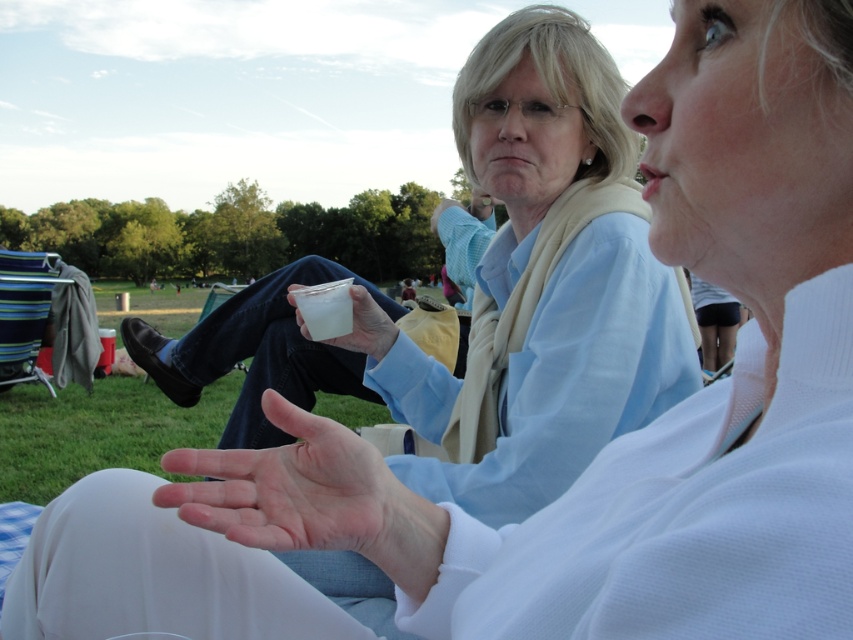
You are a photographer trying to capture a closeup of the pale skin palm at center. Based on its 2D coordinates, where should you position your camera relative to the scene?

The pale skin palm at center is located at coordinates 0.762 on the x axis and 0.340 on the y axis. To capture a closeup, position your camera directly facing the palm at those coordinates, adjusting the zoom to frame it closely without cropping important details.